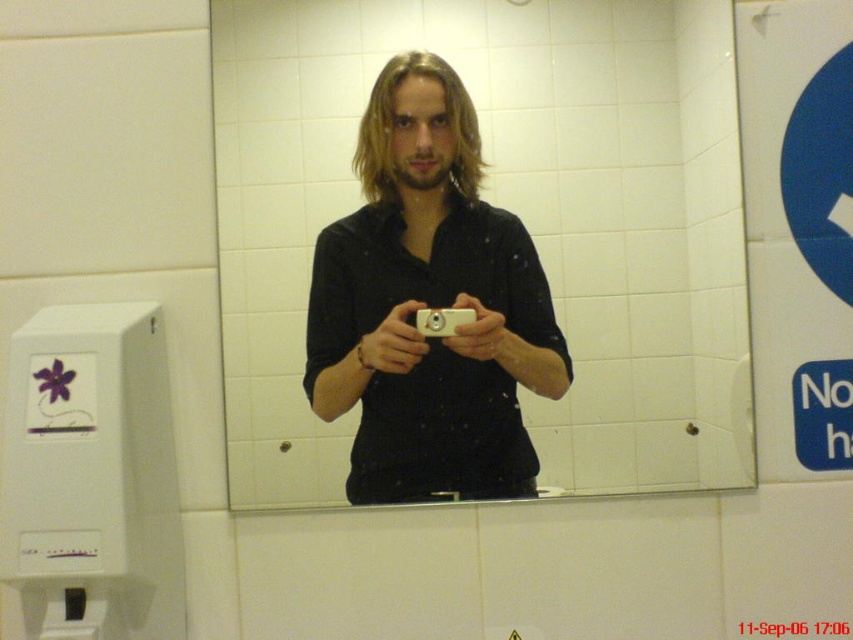
Question: Is matte black camera at center positioned behind white plastic camera at center?

Choices:
 (A) no
 (B) yes

Answer: (A)

Question: Is white glossy mirror at center smaller than white plastic camera at center?

Choices:
 (A) yes
 (B) no

Answer: (B)

Question: Considering the real-world distances, which object is closest to the white plastic camera at center?

Choices:
 (A) matte black camera at center
 (B) white glossy mirror at center

Answer: (A)

Question: Which point appears closest to the camera in this image?

Choices:
 (A) (428, 324)
 (B) (486, 262)
 (C) (233, 227)

Answer: (A)

Question: Which of the following is the closest to the observer?

Choices:
 (A) white plastic camera at center
 (B) white glossy mirror at center
 (C) matte black camera at center

Answer: (C)

Question: Does white glossy mirror at center appear over matte black camera at center?

Choices:
 (A) no
 (B) yes

Answer: (B)